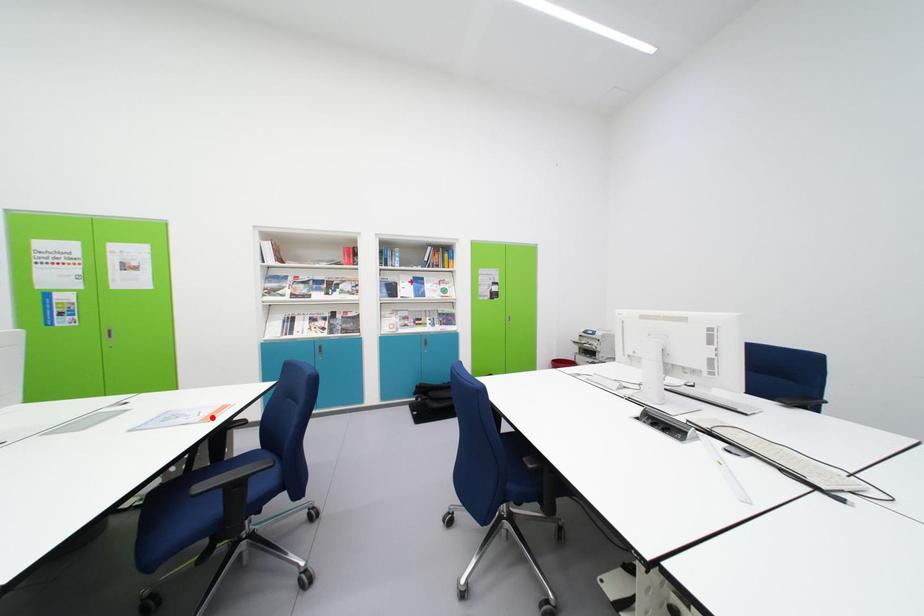
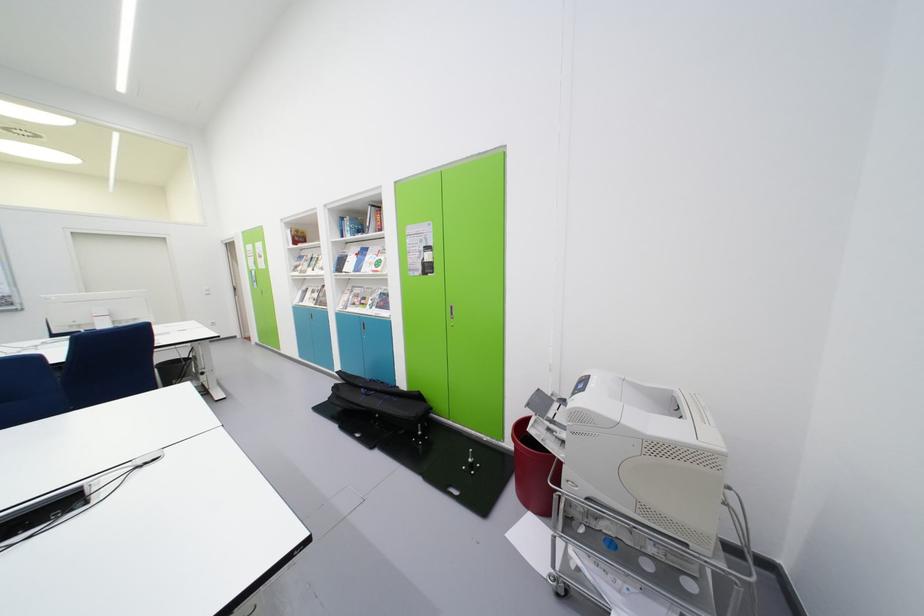
Question: I am providing you with two images of the same scene from different viewpoints. A red point is marked on the first image. At the location where the point appears in image 1, is it still visible in image 2?

Choices:
 (A) Yes
 (B) No

Answer: (B)